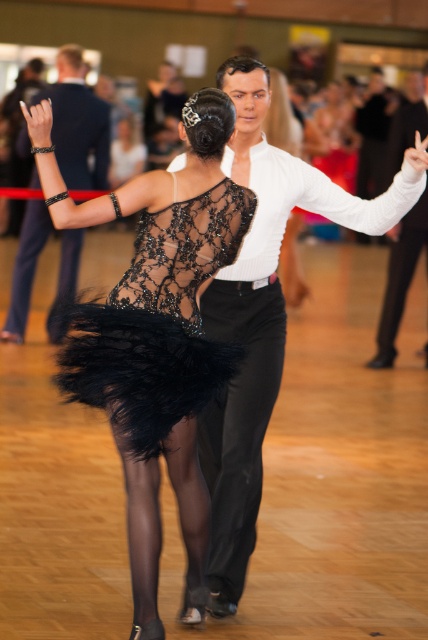
Identify the location of black lace dress at center. (157, 336).

Is point (222, 129) positioned after point (394, 342)?

That is False.

Where is `black lace dress at center`? black lace dress at center is located at coordinates (157, 336).

Is black lace dress at center to the right of lace fabric dress at center from the viewer's perspective?

No, black lace dress at center is not to the right of lace fabric dress at center.

Is black lace dress at center above lace fabric dress at center?

Actually, black lace dress at center is below lace fabric dress at center.

Is point (137, 292) positioned before point (255, 326)?

Yes.

You are a GUI agent. You are given a task and a screenshot of the screen. Output one action in this format:
    pyautogui.click(x=<x>, y=<y>)
    Task: Click on the black lace dress at center
    The height and width of the screenshot is (640, 428).
    Given the screenshot: What is the action you would take?
    pyautogui.click(x=157, y=336)

Does black lace dress at center have a larger size compared to lacy black dress at center?

Yes, black lace dress at center is bigger than lacy black dress at center.

Identify the location of black lace dress at center. This screenshot has width=428, height=640. (157, 336).

Image resolution: width=428 pixels, height=640 pixels. Find the location of `black lace dress at center`. black lace dress at center is located at coordinates (157, 336).